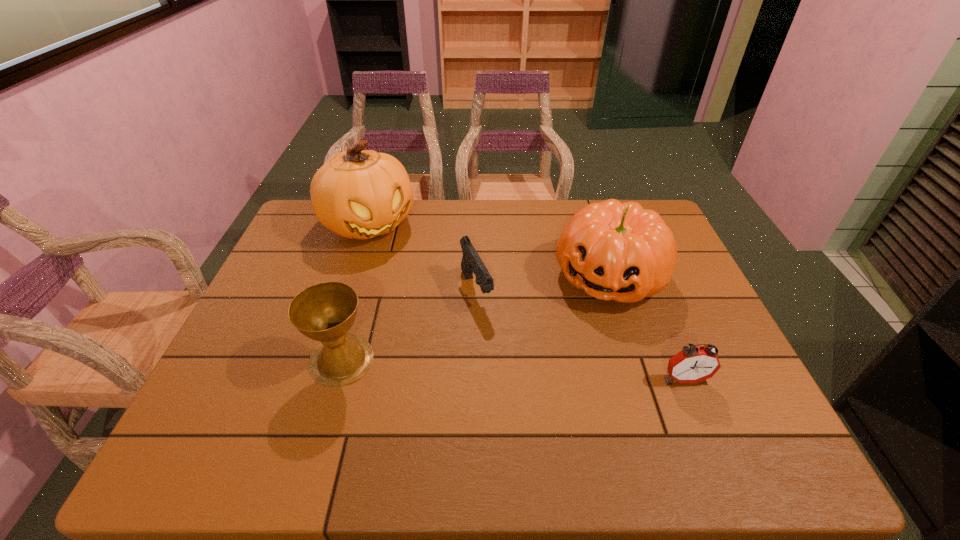
Locate an element on the screen. This screenshot has width=960, height=540. free space between the third shortest object and the alarm clock is located at coordinates pos(513,369).

You are a GUI agent. You are given a task and a screenshot of the screen. Output one action in this format:
    pyautogui.click(x=<x>, y=<y>)
    Task: Click on the blank region between the shorter pumpkin and the third object from left to right
    
    Given the screenshot: What is the action you would take?
    pyautogui.click(x=542, y=283)

The image size is (960, 540). Identify the location of free space between the third object from left to right and the chalice. (409, 325).

You are a GUI agent. You are given a task and a screenshot of the screen. Output one action in this format:
    pyautogui.click(x=<x>, y=<y>)
    Task: Click on the empty space that is in between the left pumpkin and the alarm clock
    Image resolution: width=960 pixels, height=540 pixels.
    Given the screenshot: What is the action you would take?
    pyautogui.click(x=527, y=302)

The height and width of the screenshot is (540, 960). I want to click on vacant space that is in between the alarm clock and the taller pumpkin, so click(527, 302).

Where is `free space between the pistol and the chalice`? The image size is (960, 540). free space between the pistol and the chalice is located at coordinates (409, 325).

This screenshot has width=960, height=540. I want to click on free space that is in between the alarm clock and the third tallest object, so click(x=513, y=369).

The width and height of the screenshot is (960, 540). I want to click on vacant area between the right pumpkin and the third tallest object, so click(x=475, y=318).

Point out which object is positioned as the third nearest to the right pumpkin. Please provide its 2D coordinates. Your answer should be formatted as a tuple, i.e. [(x, y)], where the tuple contains the x and y coordinates of a point satisfying the conditions above.

[(356, 194)]

At what (x,y) coordinates should I click in order to perform the action: click on object that stands as the second closest to the pistol. Please return your answer as a coordinate pair (x, y). This screenshot has height=540, width=960. Looking at the image, I should click on (617, 251).